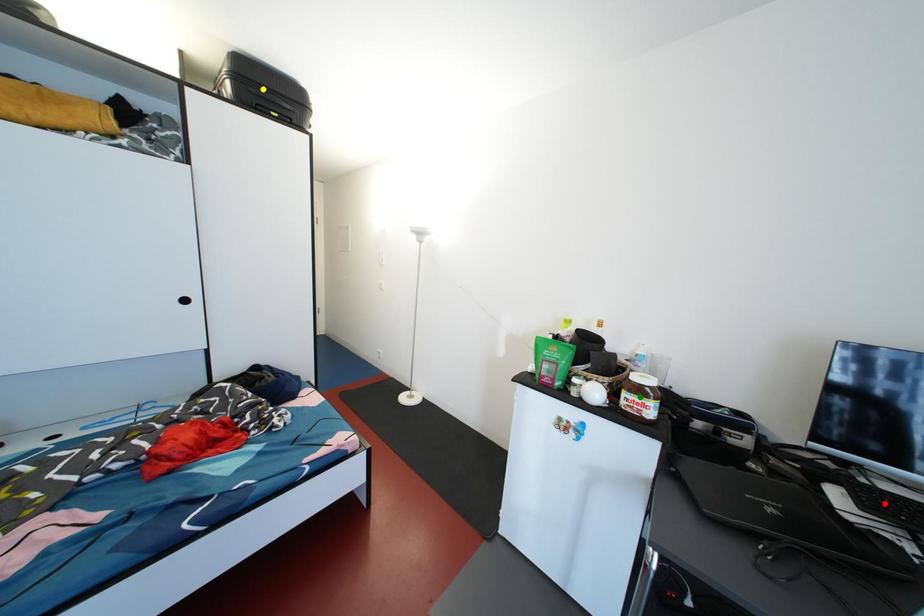
Order these from nearest to farthest:
1. yellow point
2. red point
3. green point

1. red point
2. green point
3. yellow point